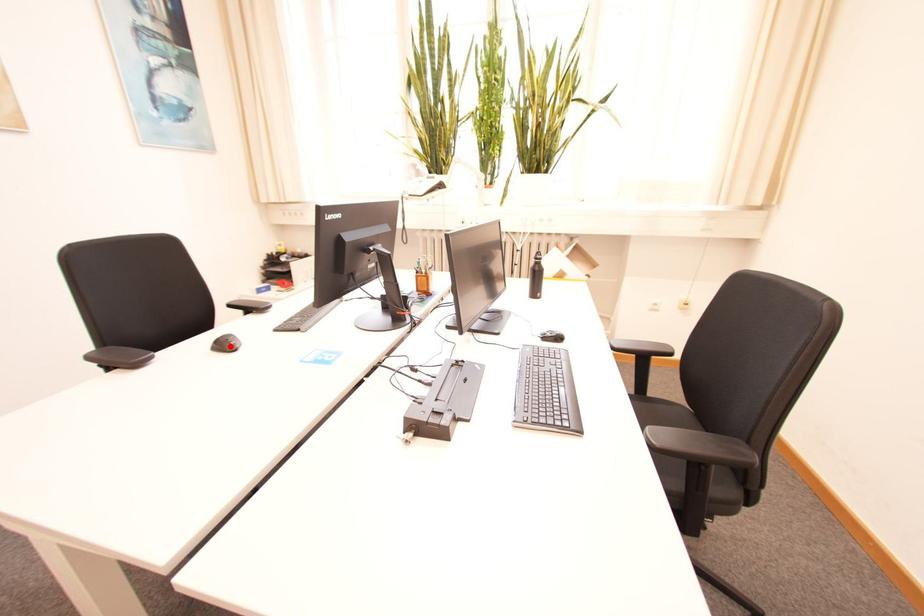
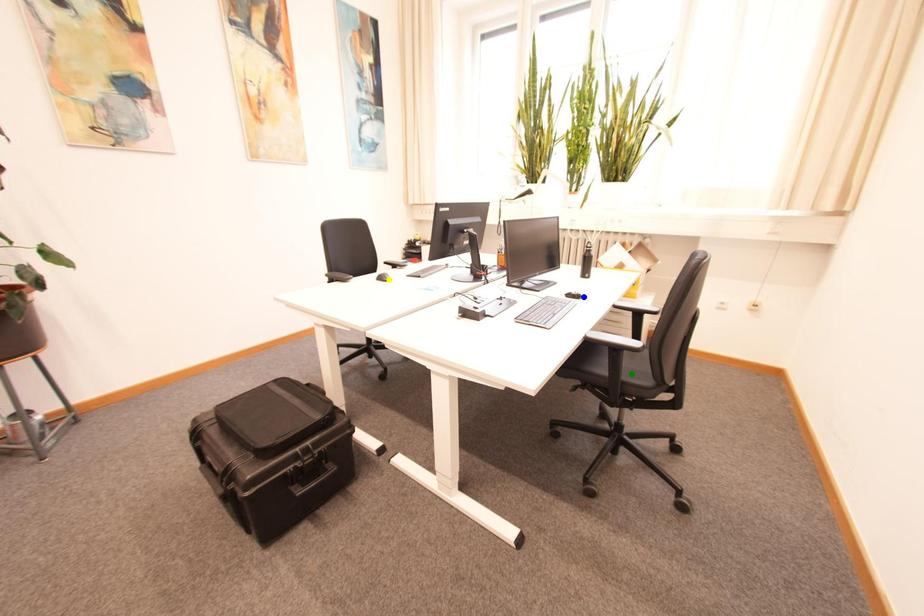
Question: I am providing you with two images of the same scene from different viewpoints. A red point is marked on the first image. You are given multiple points on the second image. Which point in image 2 is actually the same real-world point as the red point in image 1?

Choices:
 (A) yellow point
 (B) green point
 (C) blue point

Answer: (A)